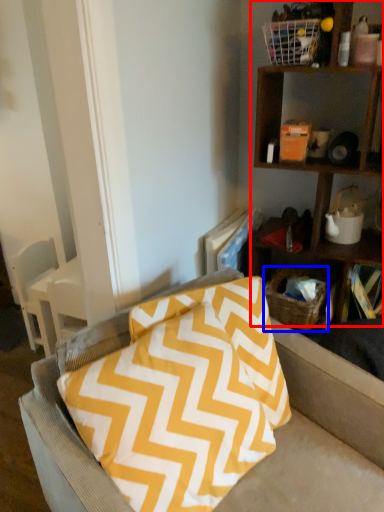
Question: Which of the following is the closest to the observer, shelf (highlighted by a red box) or basket (highlighted by a blue box)?

Choices:
 (A) shelf
 (B) basket

Answer: (A)